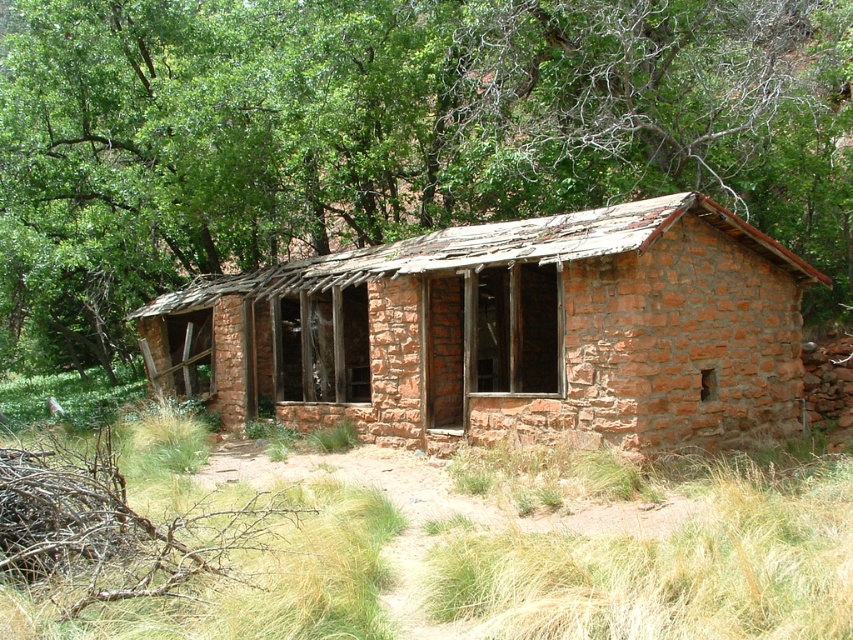
You are a hiker who needs to set up a tent. You see the rustic stone hut at center and dry grass at center. Which location would provide more space for your tent?

The rustic stone hut at center has a larger width than the dry grass at center, so it would provide more space for your tent.

You are a hiker who needs to take shelter from a sudden rainstorm. You see a green leafy tree at upper center and a rustic stone hut at center. Which one is closer to you? Please choose between the two and explain your reasoning.

The green leafy tree at upper center and rustic stone hut at center are 10.31 feet apart from each other. Since the question asks which is closer to you, but the distance between them is provided, we need to clarify the hiker position. However, based on the given information, the distance between the two objects is 10.31 feet. Without knowing the hiker location, we can only state their separation. But the question implies the hiker is at a point where both are visible, so perhaps the tree is closer if it is

You are a hiker who has just arrived at the scene. You notice the green leafy tree at upper center and the dry grass at center. Which object is higher in elevation compared to the other?

The green leafy tree at upper center is above dry grass at center, so it is higher in elevation.